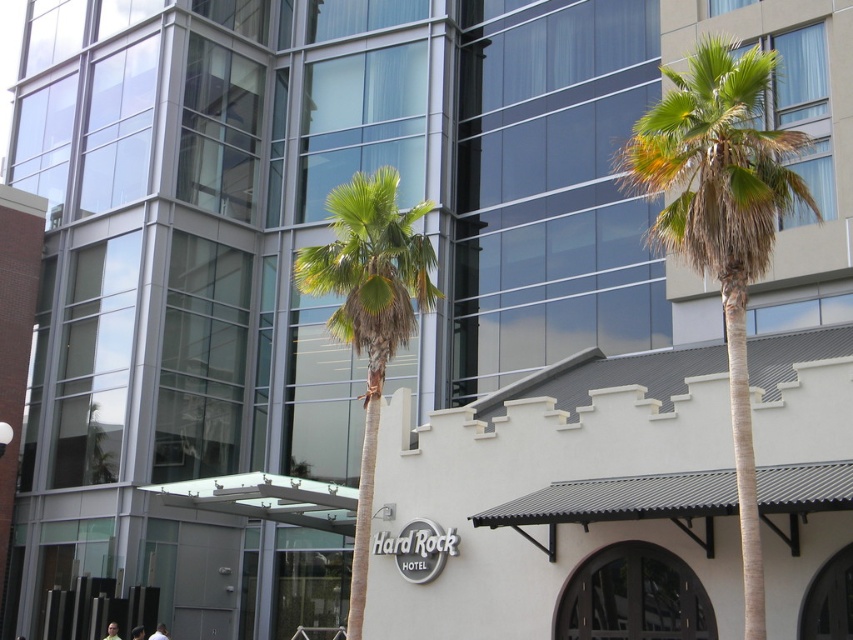
Question: Does green leafy palm tree at right appear over green leafy palm tree at center?

Choices:
 (A) no
 (B) yes

Answer: (B)

Question: Does green leafy palm tree at right have a lesser width compared to green leafy palm tree at center?

Choices:
 (A) no
 (B) yes

Answer: (B)

Question: Which object appears farthest from the camera in this image?

Choices:
 (A) green leafy palm tree at center
 (B) green leafy palm tree at right

Answer: (A)

Question: Which point is farther to the camera?

Choices:
 (A) green leafy palm tree at right
 (B) green leafy palm tree at center

Answer: (B)

Question: Is the position of green leafy palm tree at right less distant than that of green leafy palm tree at center?

Choices:
 (A) yes
 (B) no

Answer: (A)